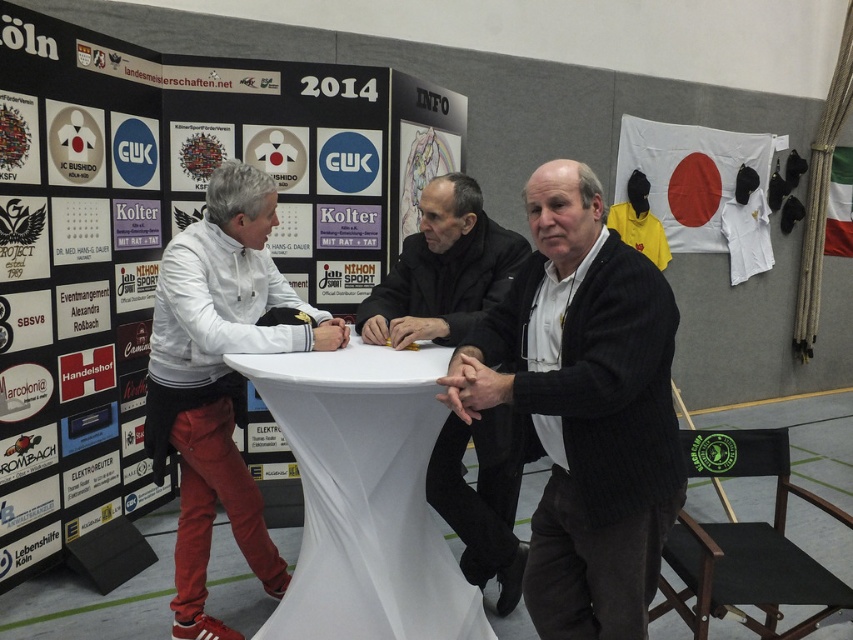
Question: Can you confirm if white cloth-covered table at center is positioned to the right of dark gray suit at center?

Choices:
 (A) no
 (B) yes

Answer: (A)

Question: Which point appears farthest from the camera in this image?

Choices:
 (A) (444, 260)
 (B) (189, 305)

Answer: (A)

Question: Which of the following is the farthest from the observer?

Choices:
 (A) black woolen sweater at center
 (B) dark gray suit at center
 (C) white cloth-covered table at center

Answer: (B)

Question: Is black woolen sweater at center bigger than white matte jacket at left?

Choices:
 (A) yes
 (B) no

Answer: (B)

Question: Where is black woolen sweater at center located in relation to white cloth-covered table at center in the image?

Choices:
 (A) left
 (B) right

Answer: (B)

Question: Which of the following is the closest to the observer?

Choices:
 (A) white cloth-covered table at center
 (B) white matte jacket at left
 (C) black woolen sweater at center

Answer: (C)